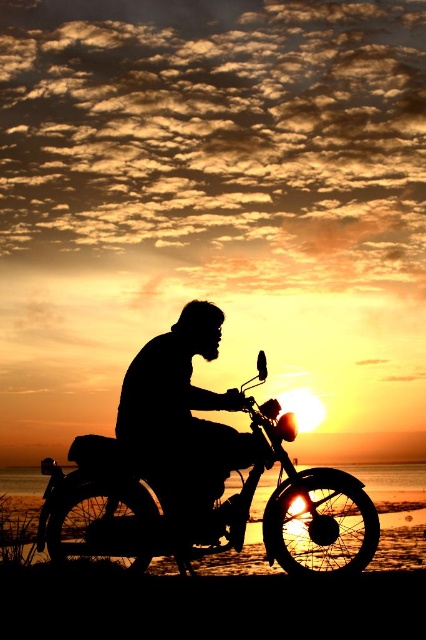
Can you confirm if silhouette man at center is wider than smooth sand at lower center?

No.

Who is shorter, silhouette man at center or smooth sand at lower center?

Standing shorter between the two is smooth sand at lower center.

Which is in front, point (264, 444) or point (265, 496)?

Point (264, 444) is more forward.

The height and width of the screenshot is (640, 426). What are the coordinates of `silhouette man at center` in the screenshot? It's located at (183, 422).

Who is more forward, (311, 497) or (187, 376)?

Point (311, 497) is more forward.

Is black matte dirt bike at center positioned in front of silhouette man at center?

Yes, black matte dirt bike at center is closer to the viewer.

Where is `black matte dirt bike at center`? black matte dirt bike at center is located at coordinates (131, 509).

Can you confirm if black matte dirt bike at center is bigger than smooth sand at lower center?

Actually, black matte dirt bike at center might be smaller than smooth sand at lower center.

Between point (132, 528) and point (164, 572), which one is positioned in front?

Point (132, 528) is more forward.

Image resolution: width=426 pixels, height=640 pixels. What are the coordinates of `black matte dirt bike at center` in the screenshot? It's located at (131, 509).